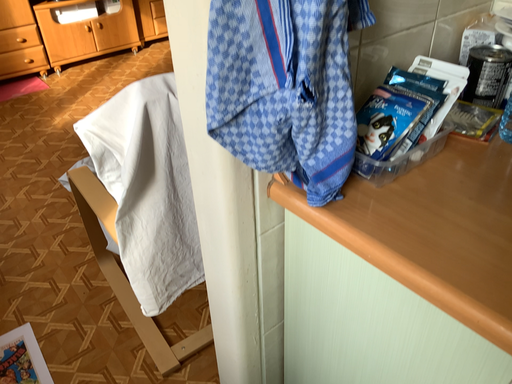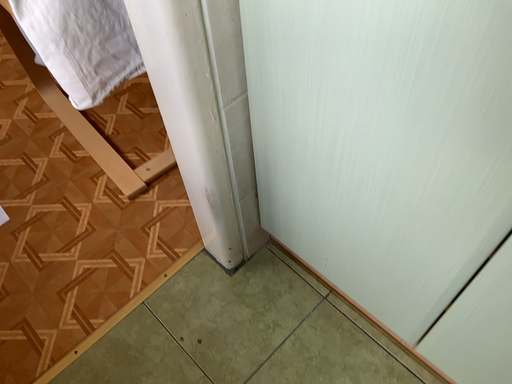
Question: How did the camera likely rotate when shooting the video?

Choices:
 (A) rotated downward
 (B) rotated upward

Answer: (A)